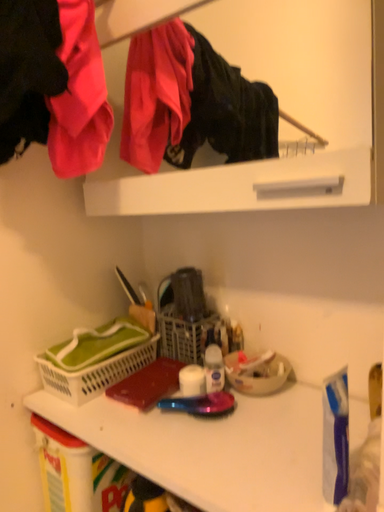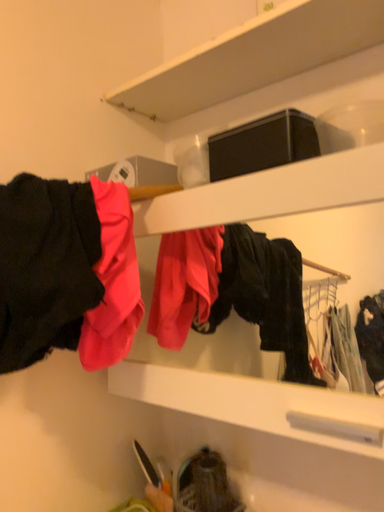
Question: Which way did the camera rotate in the video?

Choices:
 (A) rotated upward
 (B) rotated downward

Answer: (A)